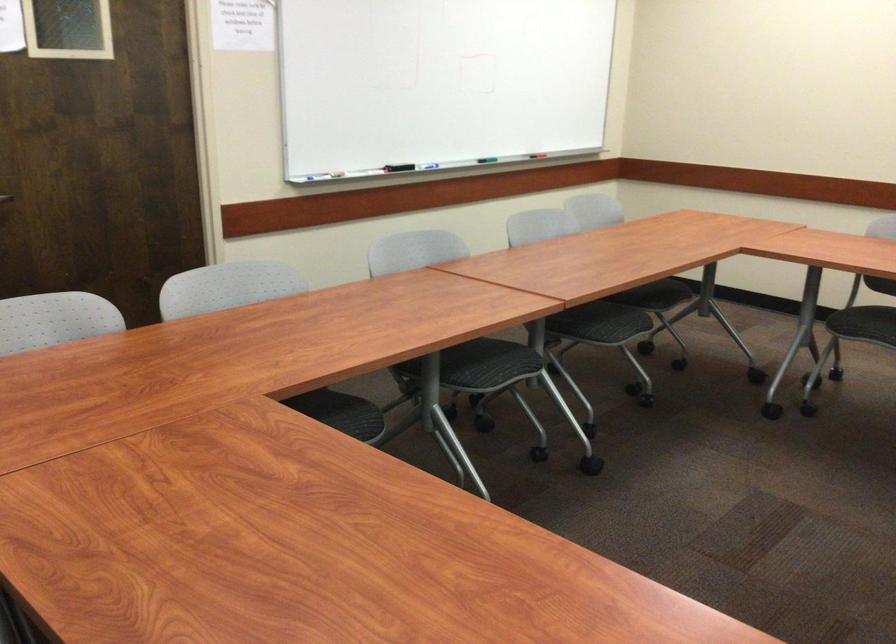
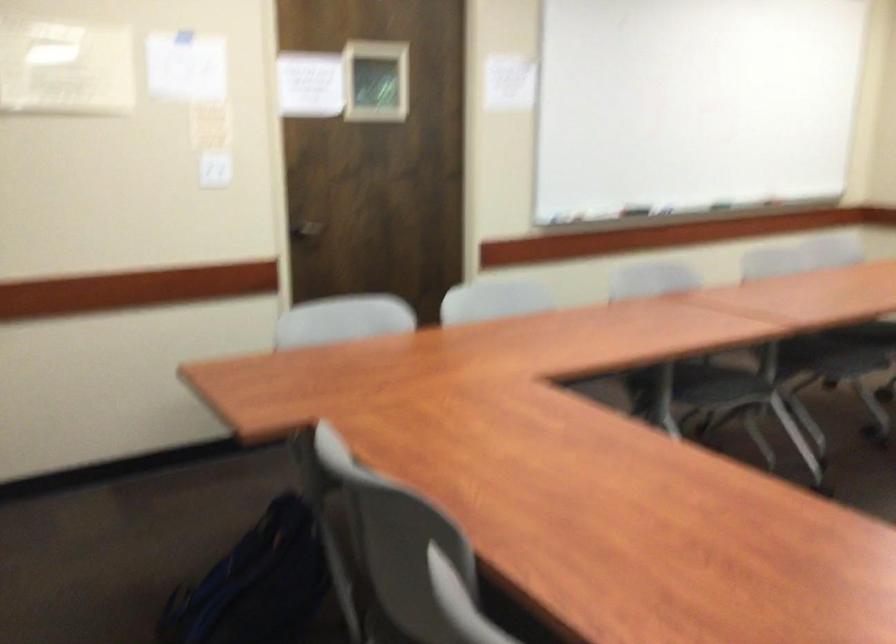
Find the pixel in the second image that matches pixel 472 370 in the first image.

(712, 386)